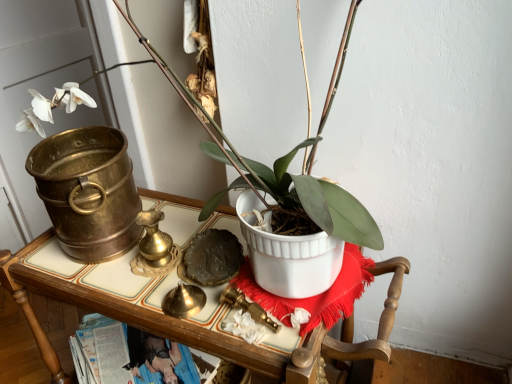
Find the location of a particular element. The height and width of the screenshot is (384, 512). vacant space underneath white matte pot at center (from a real-world perspective) is located at coordinates (195, 236).